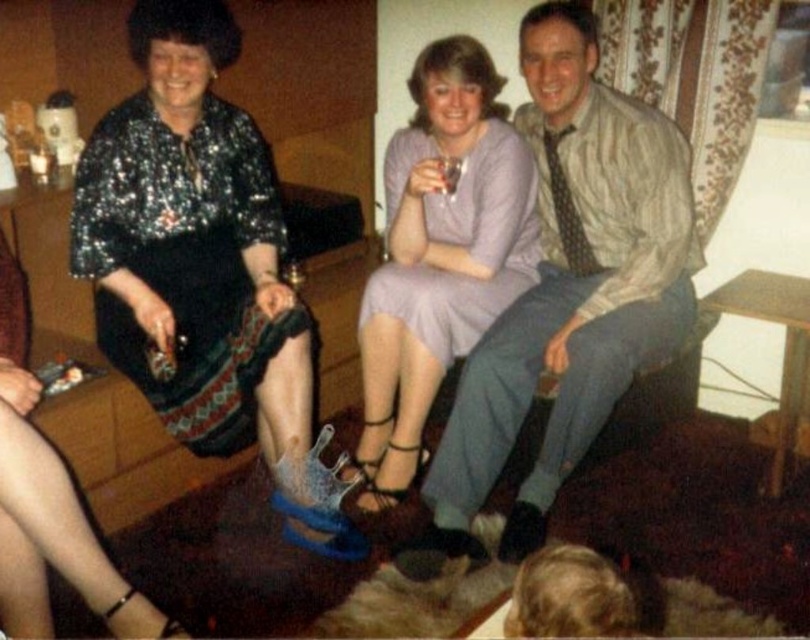
Question: Is matte beige shirt at center smaller than purple satin dress at center?

Choices:
 (A) yes
 (B) no

Answer: (B)

Question: Is matte beige shirt at center to the right of purple satin dress at center from the viewer's perspective?

Choices:
 (A) no
 (B) yes

Answer: (B)

Question: Which of the following is the farthest from the observer?

Choices:
 (A) matte beige shirt at center
 (B) purple satin dress at center
 (C) shiny sequined dress at upper left

Answer: (B)

Question: Among these points, which one is nearest to the camera?

Choices:
 (A) (553, 86)
 (B) (266, 360)
 (C) (506, 300)

Answer: (B)

Question: Does matte beige shirt at center have a lesser width compared to purple satin dress at center?

Choices:
 (A) yes
 (B) no

Answer: (B)

Question: Which point appears closest to the camera in this image?

Choices:
 (A) (438, 93)
 (B) (212, 77)

Answer: (B)